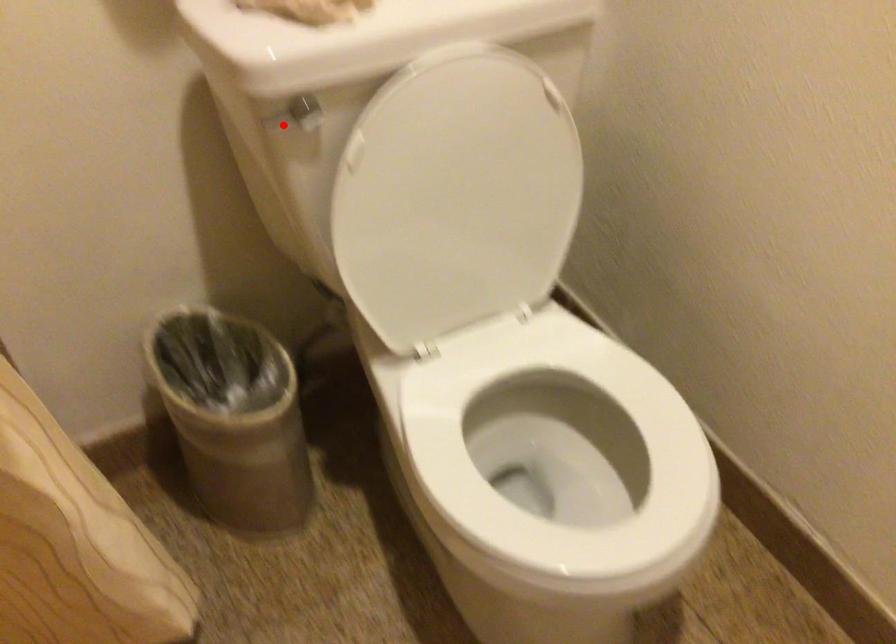
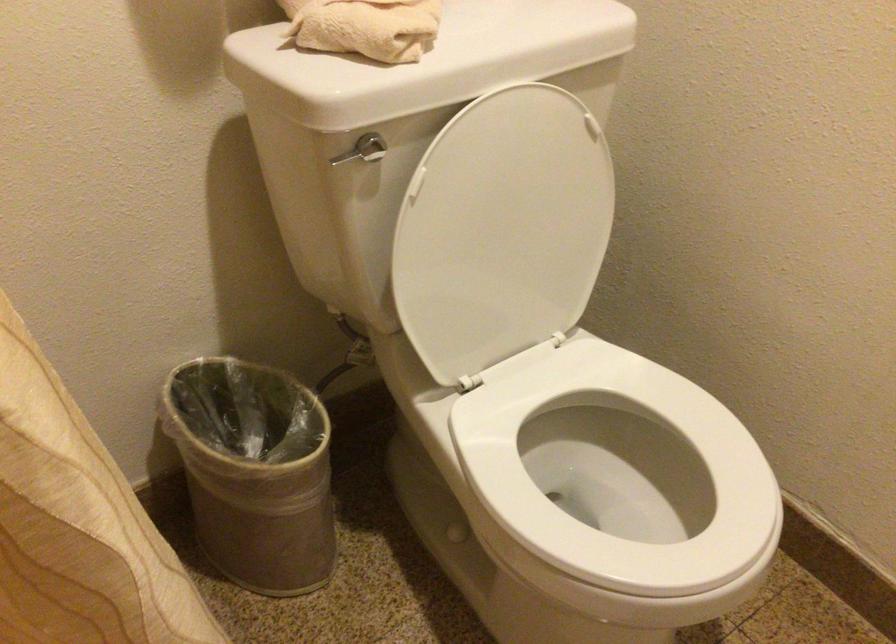
Locate, in the second image, the point that corresponds to the highlighted location in the first image.

(348, 155)